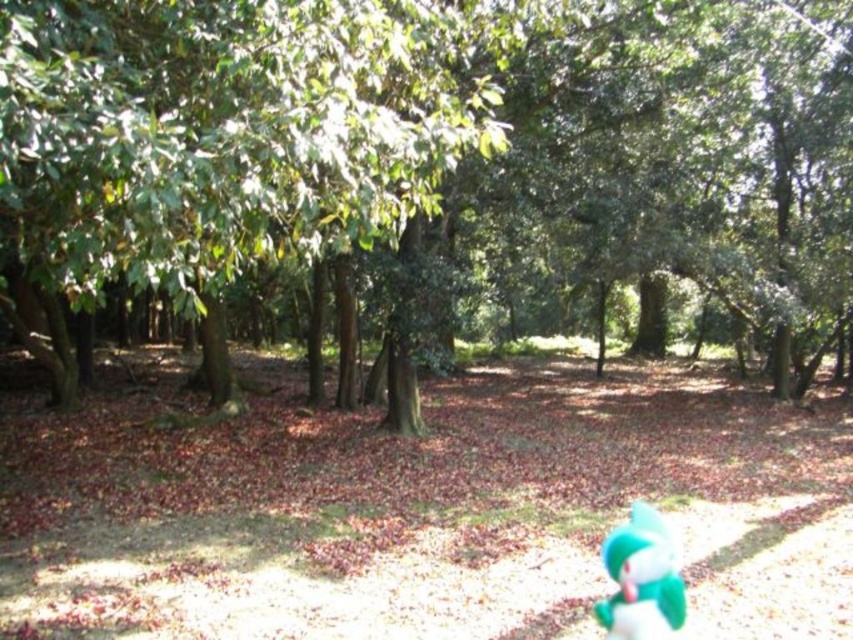
You are standing in the forest and want to take a photo of the green leafy tree at center. If your camera has a maximum focus range of 10 feet, will you be able to capture it clearly?

The green leafy tree at center and viewer are 9.35 feet apart from each other, so yes, the camera can focus on the green leafy tree at center since the distance is within the 10 feet range.

You are a hiker who wants to place a small backpack between the green leafy tree at center and the teal plush toy at lower right. The backpack requires a minimum of 8 meters of space to be placed safely. Can you fit the backpack between them?

The green leafy tree at center and teal plush toy at lower right are 8.53 meters apart, so yes, the backpack can be placed between them as the distance is sufficient to meet the minimum requirement of 8 meters.